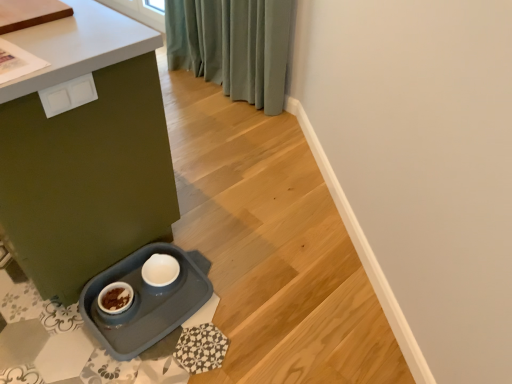
Question: In terms of height, does white plastic drawer at upper left look taller or shorter compared to matte gray tray at lower left?

Choices:
 (A) tall
 (B) short

Answer: (B)

Question: Is white plastic drawer at upper left in front of or behind matte gray tray at lower left in the image?

Choices:
 (A) behind
 (B) front

Answer: (A)

Question: From the image's perspective, is white plastic drawer at upper left located above or below matte gray tray at lower left?

Choices:
 (A) above
 (B) below

Answer: (B)

Question: Is matte gray tray at lower left to the left or to the right of white plastic drawer at upper left in the image?

Choices:
 (A) right
 (B) left

Answer: (B)

Question: Considering the positions of matte gray tray at lower left and white plastic drawer at upper left in the image, is matte gray tray at lower left taller or shorter than white plastic drawer at upper left?

Choices:
 (A) short
 (B) tall

Answer: (B)

Question: Does point (129, 104) appear closer or farther from the camera than point (74, 79)?

Choices:
 (A) closer
 (B) farther

Answer: (B)

Question: Considering the positions of matte gray tray at lower left and white plastic drawer at upper left in the image, is matte gray tray at lower left bigger or smaller than white plastic drawer at upper left?

Choices:
 (A) small
 (B) big

Answer: (B)